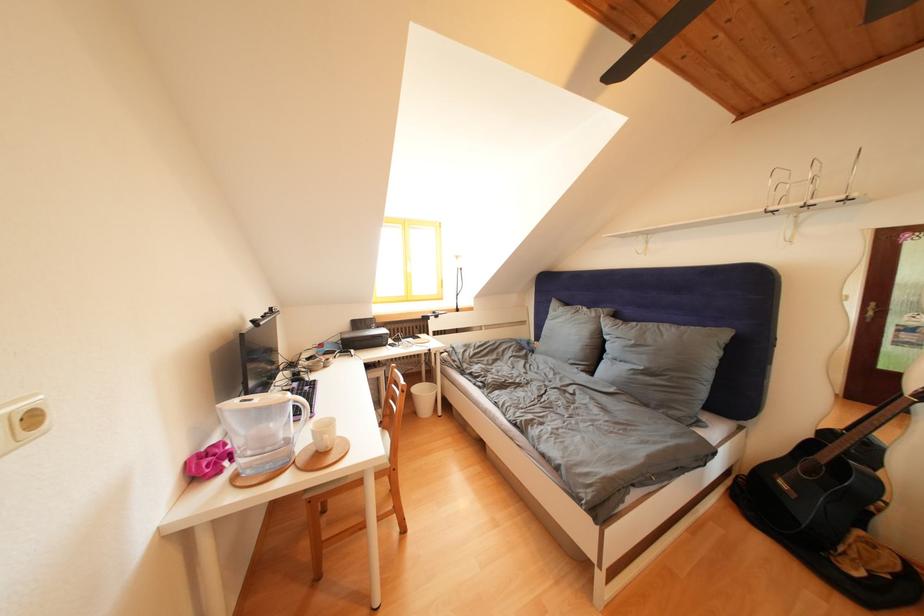
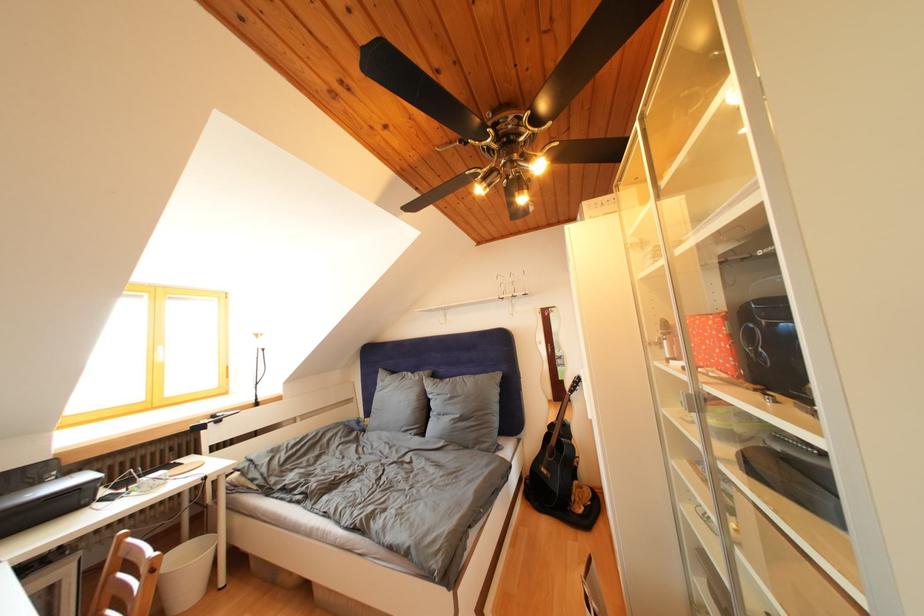
Find the pixel in the second image that matches (575,310) in the first image.

(400, 378)